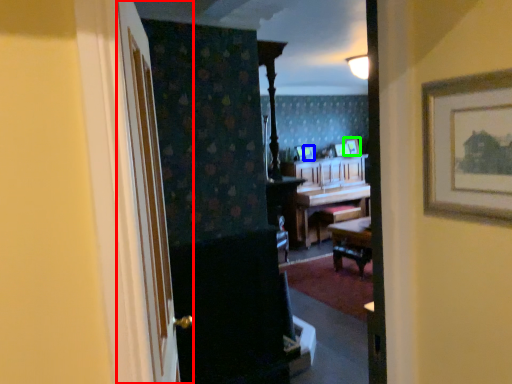
Question: Which object is the closest to the door (highlighted by a red box)? Choose among these: picture frame (highlighted by a blue box) or picture frame (highlighted by a green box).

Choices:
 (A) picture frame
 (B) picture frame

Answer: (A)